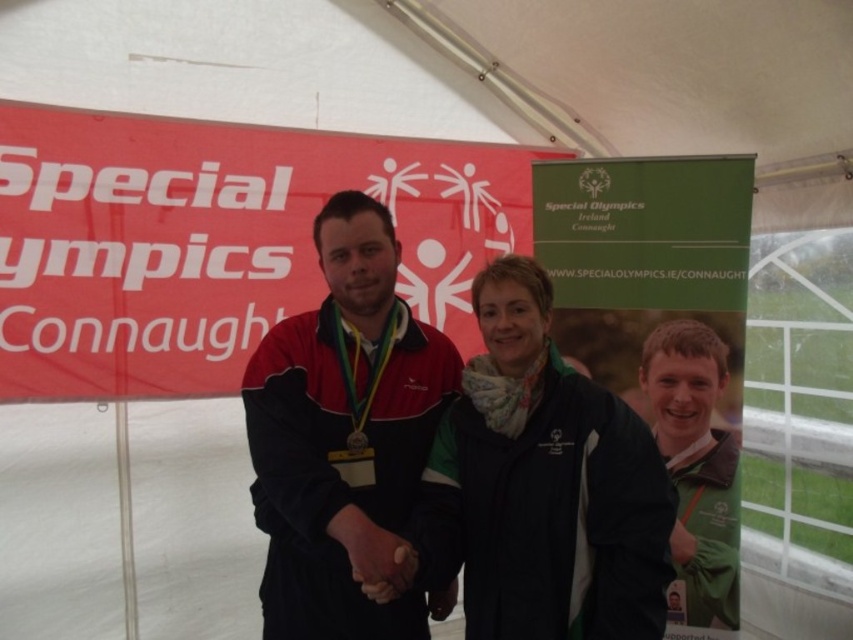
Question: Can you confirm if matte black jacket at center is positioned below green fabric jacket at center?

Choices:
 (A) yes
 (B) no

Answer: (B)

Question: Is the position of matte black jacket at center less distant than that of green fabric jacket at center?

Choices:
 (A) no
 (B) yes

Answer: (B)

Question: Does matte black jacket at center appear over green fabric jacket at center?

Choices:
 (A) yes
 (B) no

Answer: (A)

Question: Which point is farther from the camera taking this photo?

Choices:
 (A) pyautogui.click(x=262, y=406)
 (B) pyautogui.click(x=692, y=532)

Answer: (B)